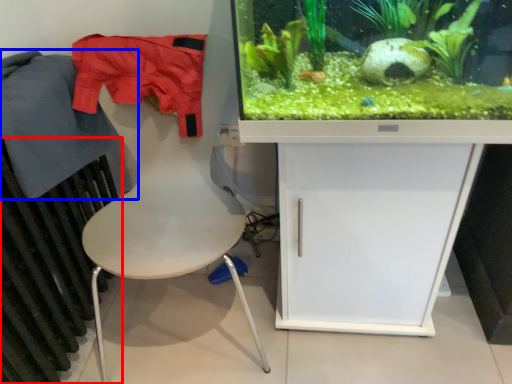
Question: Which point is further to the camera, radiator (highlighted by a red box) or clothing (highlighted by a blue box)?

Choices:
 (A) radiator
 (B) clothing

Answer: (B)